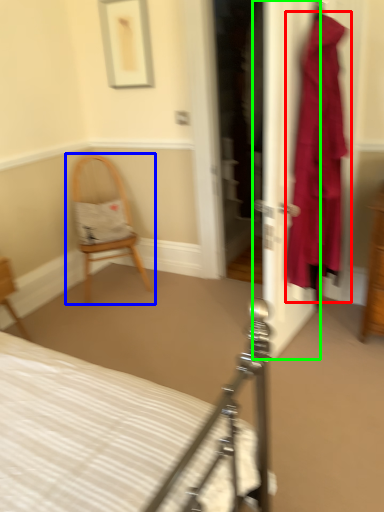
Question: Based on their relative distances, which object is farther from clothing (highlighted by a red box)? Choose from chair (highlighted by a blue box) and door (highlighted by a green box).

Choices:
 (A) chair
 (B) door

Answer: (A)